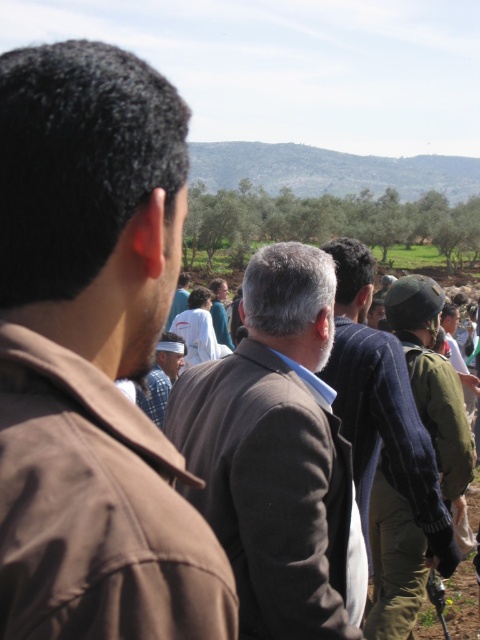
Is brown fabric jacket at left below white cotton shirt at center?

No.

Does brown fabric jacket at left have a smaller size compared to white cotton shirt at center?

Correct, brown fabric jacket at left occupies less space than white cotton shirt at center.

Where is `brown fabric jacket at left`? brown fabric jacket at left is located at coordinates (93, 355).

Does brown woolen jacket at center appear under green military uniform at right?

Yes.

Does brown woolen jacket at center have a larger size compared to green military uniform at right?

Correct, brown woolen jacket at center is larger in size than green military uniform at right.

Describe the element at coordinates (275, 452) in the screenshot. I see `brown woolen jacket at center` at that location.

I want to click on brown woolen jacket at center, so point(275,452).

What do you see at coordinates (93, 355) in the screenshot? I see `brown fabric jacket at left` at bounding box center [93, 355].

Is brown fabric jacket at left to the left of green military uniform at right from the viewer's perspective?

Indeed, brown fabric jacket at left is positioned on the left side of green military uniform at right.

The width and height of the screenshot is (480, 640). Find the location of `brown fabric jacket at left`. brown fabric jacket at left is located at coordinates (93, 355).

This screenshot has height=640, width=480. In order to click on brown fabric jacket at left in this screenshot , I will do `click(93, 355)`.